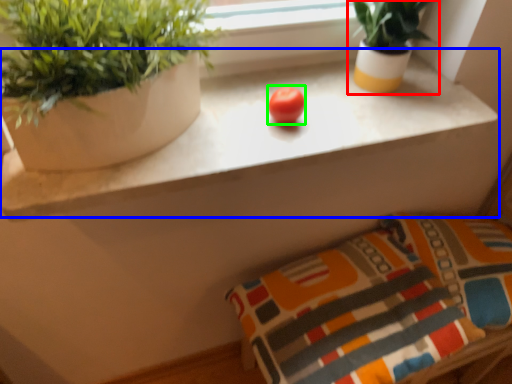
Question: Estimate the real-world distances between objects in this image. Which object is closer to houseplant (highlighted by a red box), counter (highlighted by a blue box) or fruit (highlighted by a green box)?

Choices:
 (A) counter
 (B) fruit

Answer: (A)